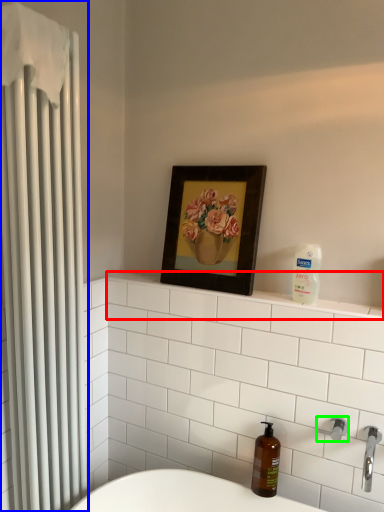
Question: Which object is positioned closest to balustrade (highlighted by a red box)? Select from shower curtain (highlighted by a blue box) and shower (highlighted by a green box).

Choices:
 (A) shower curtain
 (B) shower

Answer: (B)